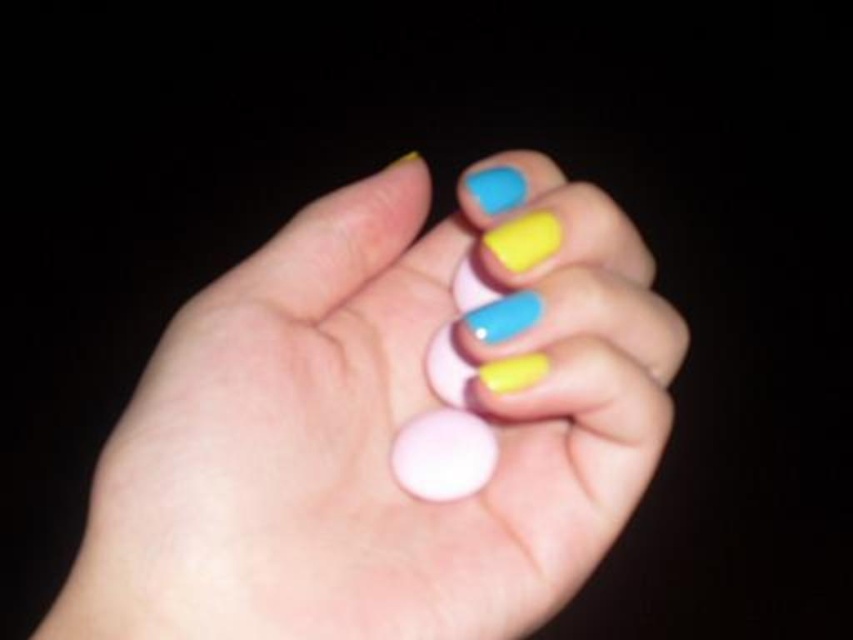
Question: Which point is closer to the camera taking this photo?

Choices:
 (A) (448, 496)
 (B) (625, 336)

Answer: (B)

Question: Which point is closer to the camera?

Choices:
 (A) matte blue nail polish at center
 (B) matte plastic hand at center

Answer: (B)

Question: Is matte plastic hand at center closer to camera compared to matte blue nail polish at center?

Choices:
 (A) no
 (B) yes

Answer: (B)

Question: Considering the relative positions of matte plastic hand at center and matte blue nail polish at center in the image provided, where is matte plastic hand at center located with respect to matte blue nail polish at center?

Choices:
 (A) above
 (B) below

Answer: (B)

Question: Is matte plastic hand at center bigger than matte blue nail polish at center?

Choices:
 (A) yes
 (B) no

Answer: (A)